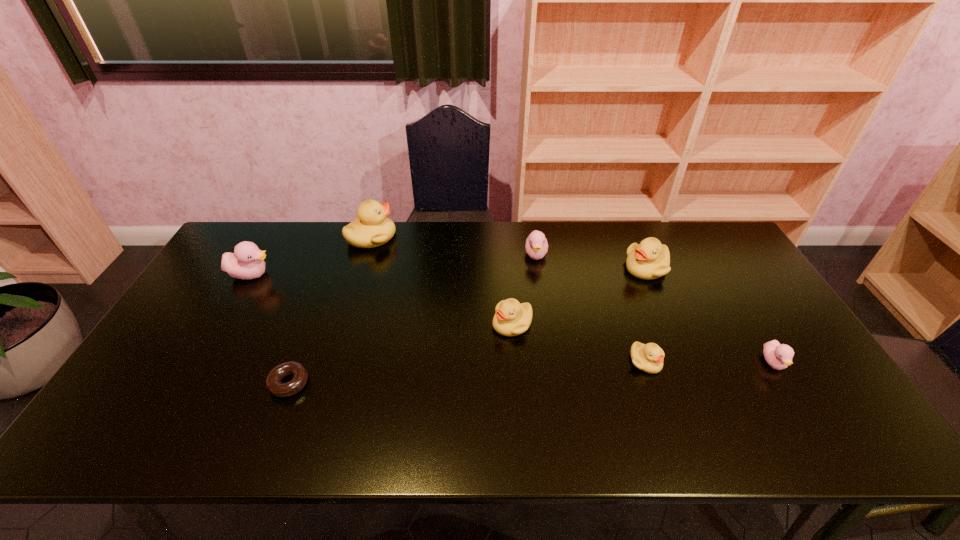
Where is `free spot at the near edge of the desktop`? free spot at the near edge of the desktop is located at coordinates (667, 449).

The width and height of the screenshot is (960, 540). In the image, there is a desktop. Find the location of `free space at the left edge`. free space at the left edge is located at coordinates (220, 304).

I want to click on free region at the right edge, so click(x=769, y=319).

The width and height of the screenshot is (960, 540). In the image, there is a desktop. Find the location of `vacant space at the near right corner`. vacant space at the near right corner is located at coordinates (853, 434).

Identify the location of unoccupied position between the second pink duckling from left to right and the rightmost duckling. The width and height of the screenshot is (960, 540). (655, 309).

You are a GUI agent. You are given a task and a screenshot of the screen. Output one action in this format:
    pyautogui.click(x=<x>, y=<y>)
    Task: Click on the vacant area that lies between the leftmost pink duckling and the sixth duckling from right to left
    The image size is (960, 540).
    Given the screenshot: What is the action you would take?
    (312, 256)

Find the location of a particular element. empty location between the fourth duckling from left to right and the brown doughnut is located at coordinates (412, 319).

Image resolution: width=960 pixels, height=540 pixels. Find the location of `free area in between the nearest pink duckling and the farthest yellow duckling`. free area in between the nearest pink duckling and the farthest yellow duckling is located at coordinates (572, 300).

Where is `vacant area that lies between the fourth object from right to left and the fourth nearest object`? Image resolution: width=960 pixels, height=540 pixels. vacant area that lies between the fourth object from right to left and the fourth nearest object is located at coordinates (524, 289).

What are the coordinates of `vacant area that lies between the third smallest yellow duckling and the fourth duckling from left to right` in the screenshot? It's located at (591, 261).